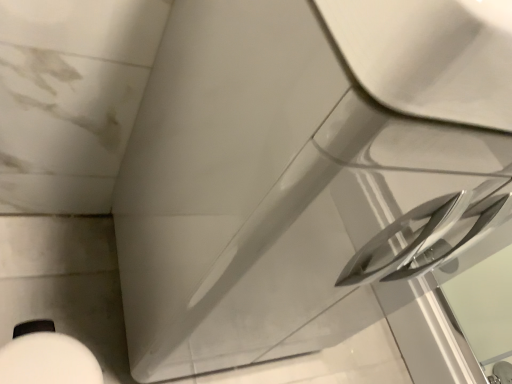
Where is `white glossy toilet at lower left`? The height and width of the screenshot is (384, 512). white glossy toilet at lower left is located at coordinates (48, 361).

What do you see at coordinates (48, 361) in the screenshot? The height and width of the screenshot is (384, 512). I see `white glossy toilet at lower left` at bounding box center [48, 361].

Image resolution: width=512 pixels, height=384 pixels. I want to click on white glossy toilet at lower left, so click(48, 361).